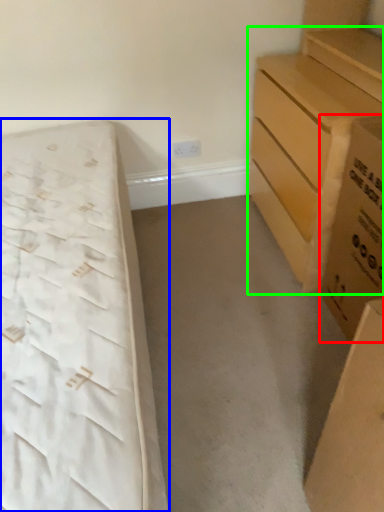
Question: Which object is the farthest from cardboard box (highlighted by a red box)? Choose among these: bed (highlighted by a blue box) or chest of drawers (highlighted by a green box).

Choices:
 (A) bed
 (B) chest of drawers

Answer: (A)